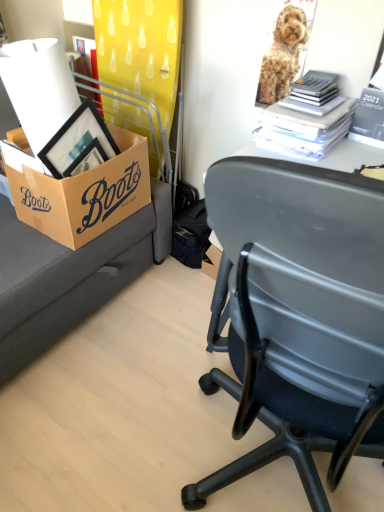
Question: From a real-world perspective, is white paper stack at upper right, which ranks as the 1th book in left-to-right order, over black paper calendar at upper right, arranged as the 2th book when viewed from the left?

Choices:
 (A) no
 (B) yes

Answer: (A)

Question: Is white paper stack at upper right, which ranks as the 1th book in left-to-right order, smaller than black paper calendar at upper right, arranged as the 2th book when viewed from the left?

Choices:
 (A) no
 (B) yes

Answer: (A)

Question: From a real-world perspective, is white paper stack at upper right, which is the second book in right-to-left order, physically below black paper calendar at upper right, arranged as the 2th book when viewed from the left?

Choices:
 (A) no
 (B) yes

Answer: (B)

Question: Does white paper stack at upper right, which is the second book in right-to-left order, have a greater width compared to black paper calendar at upper right, the first book viewed from the right?

Choices:
 (A) yes
 (B) no

Answer: (A)

Question: Is white paper stack at upper right, which is the second book in right-to-left order, at the right side of black paper calendar at upper right, arranged as the 2th book when viewed from the left?

Choices:
 (A) no
 (B) yes

Answer: (A)

Question: From their relative heights in the image, would you say brown cardboard box at left is taller or shorter than white paper stack at upper right, which is the second book in right-to-left order?

Choices:
 (A) tall
 (B) short

Answer: (A)

Question: Considering the positions of brown cardboard box at left and white paper stack at upper right, which is the second book in right-to-left order, in the image, is brown cardboard box at left wider or thinner than white paper stack at upper right, which is the second book in right-to-left order,?

Choices:
 (A) thin
 (B) wide

Answer: (B)

Question: Would you say brown cardboard box at left is to the left or to the right of white paper stack at upper right, which is the second book in right-to-left order, in the picture?

Choices:
 (A) left
 (B) right

Answer: (A)

Question: From the image's perspective, relative to white paper stack at upper right, which ranks as the 1th book in left-to-right order, is brown cardboard box at left above or below?

Choices:
 (A) above
 (B) below

Answer: (B)

Question: In the image, is golden fur dog at upper right positioned in front of or behind brown cardboard box at left?

Choices:
 (A) behind
 (B) front

Answer: (A)

Question: In the image, is golden fur dog at upper right on the left side or the right side of brown cardboard box at left?

Choices:
 (A) left
 (B) right

Answer: (B)

Question: Is point (266, 102) closer or farther from the camera than point (26, 166)?

Choices:
 (A) farther
 (B) closer

Answer: (A)

Question: Is golden fur dog at upper right wider or thinner than brown cardboard box at left?

Choices:
 (A) thin
 (B) wide

Answer: (A)

Question: From a real-world perspective, is black paper calendar at upper right, arranged as the 2th book when viewed from the left, positioned above or below white paper stack at upper right, which is the second book in right-to-left order?

Choices:
 (A) above
 (B) below

Answer: (A)

Question: In the image, is black paper calendar at upper right, the first book viewed from the right, positioned in front of or behind white paper stack at upper right, which ranks as the 1th book in left-to-right order?

Choices:
 (A) behind
 (B) front

Answer: (B)